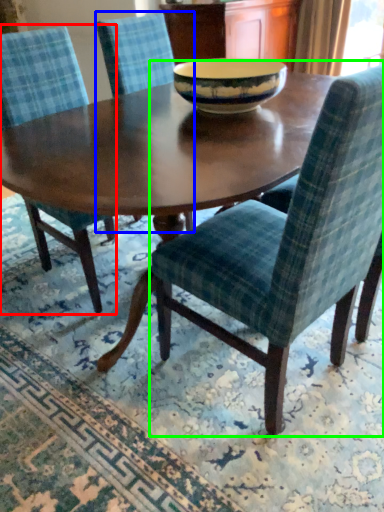
Question: Which object is the closest to the chair (highlighted by a red box)? Choose among these: chair (highlighted by a blue box) or chair (highlighted by a green box).

Choices:
 (A) chair
 (B) chair

Answer: (B)